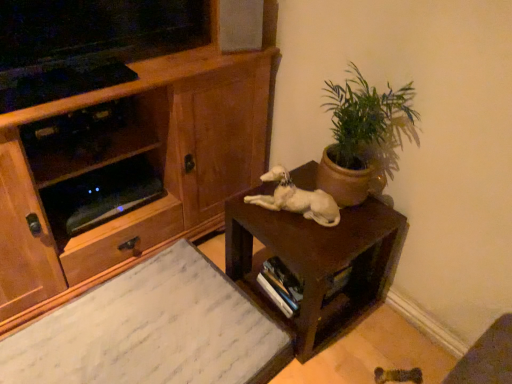
Identify the location of free space above brown matte table at center (from a real-world perspective). (318, 216).